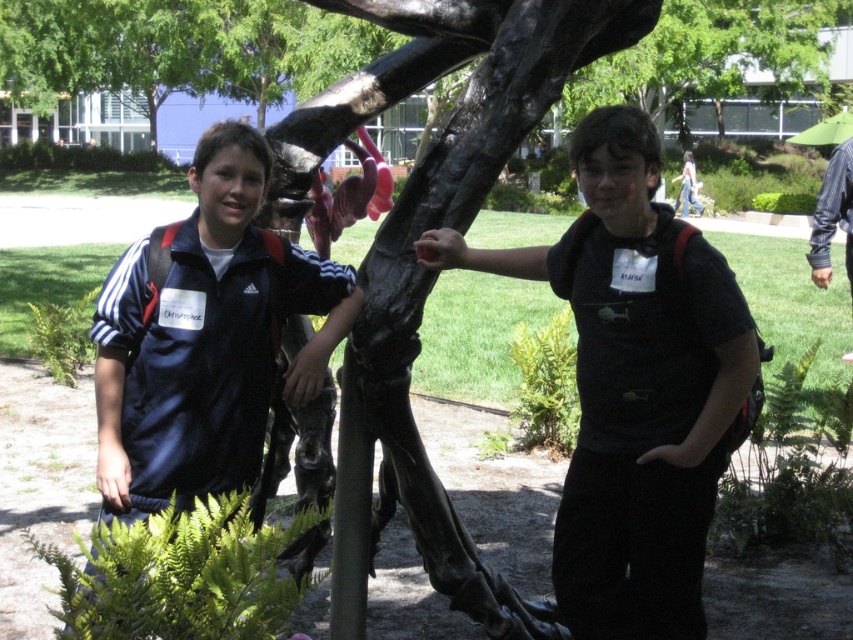
Question: Is matte black backpack at center closer to camera compared to black polished tree trunk at center?

Choices:
 (A) no
 (B) yes

Answer: (B)

Question: Where is dark blue fabric jacket at left located in relation to green matte tree at upper center in the image?

Choices:
 (A) left
 (B) right

Answer: (A)

Question: Which object is farther from the camera taking this photo?

Choices:
 (A) dark blue fabric jacket at left
 (B) blue striped shirt at upper right
 (C) black polished tree trunk at center
 (D) matte black backpack at center

Answer: (B)

Question: Among these points, which one is farthest from the camera?

Choices:
 (A) (833, 173)
 (B) (596, 77)
 (C) (308, 3)

Answer: (B)

Question: Does matte black backpack at center lie in front of dark blue fabric jacket at left?

Choices:
 (A) yes
 (B) no

Answer: (A)

Question: Which object is positioned closest to the green matte tree at upper center?

Choices:
 (A) blue striped shirt at upper right
 (B) black polished tree trunk at center
 (C) matte black backpack at center
 (D) dark blue fabric jacket at left

Answer: (D)